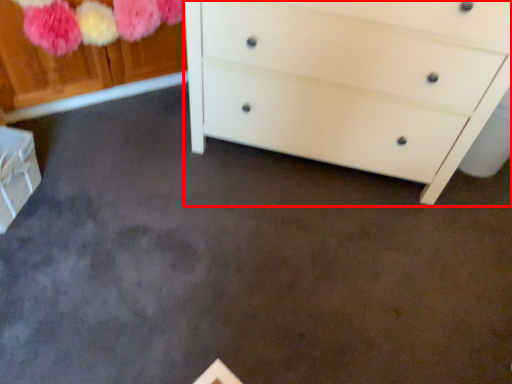
Question: From the image's perspective, considering the relative positions of chest of drawers (annotated by the red box) and cabinetry in the image provided, where is chest of drawers (annotated by the red box) located with respect to the staircase?

Choices:
 (A) above
 (B) below

Answer: (A)